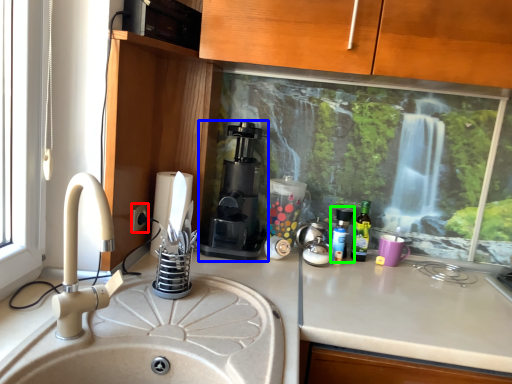
Question: Based on their relative distances, which object is farther from electric outlet (highlighted by a red box)? Choose from coffee machine (highlighted by a blue box) and bottle (highlighted by a green box).

Choices:
 (A) coffee machine
 (B) bottle

Answer: (B)